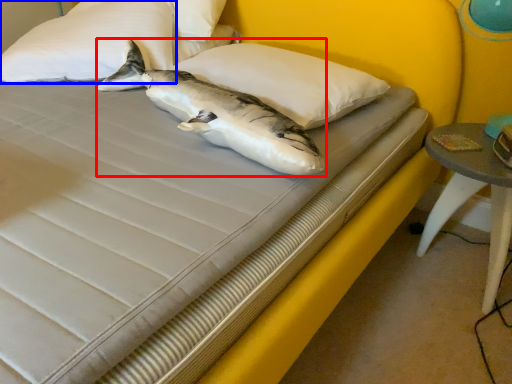
Question: Which object appears farthest to the camera in this image, shark (highlighted by a red box) or pillow (highlighted by a blue box)?

Choices:
 (A) shark
 (B) pillow

Answer: (B)